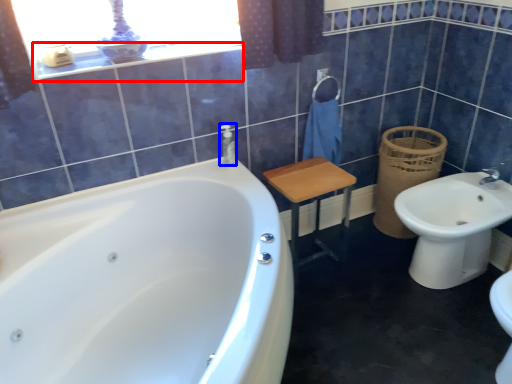
Question: Which object appears closest to the camera in this image, balustrade (highlighted by a red box) or toiletry (highlighted by a blue box)?

Choices:
 (A) balustrade
 (B) toiletry

Answer: (A)